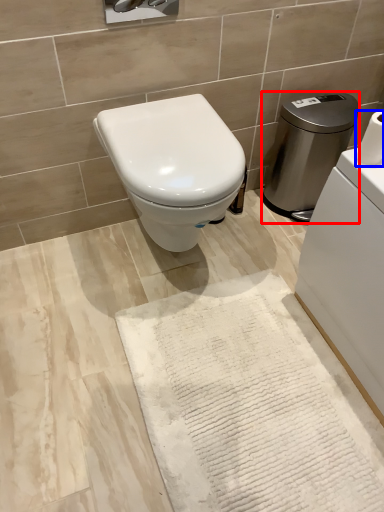
Question: Which point is closer to the camera, water heater (highlighted by a red box) or toilet paper (highlighted by a blue box)?

Choices:
 (A) water heater
 (B) toilet paper

Answer: (B)